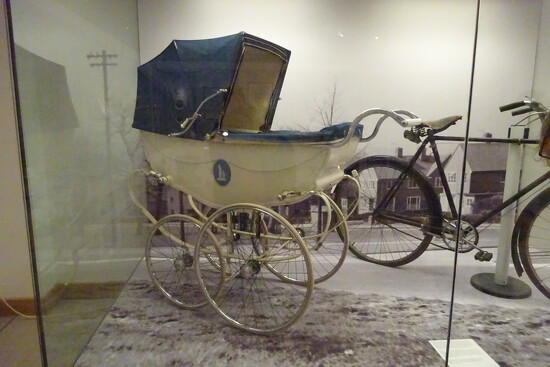
The image size is (550, 367). Find the location of `wall`. wall is located at coordinates (471, 72).